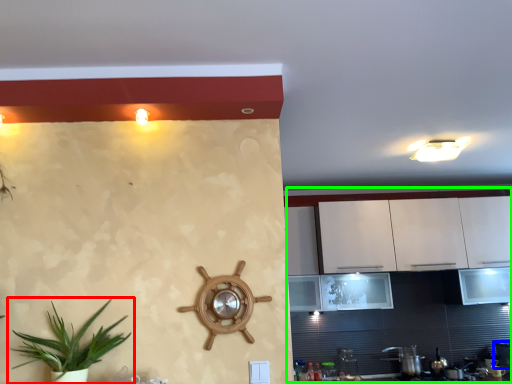
Question: Which object is the farthest from houseplant (highlighted by a red box)? Choose among these: appliance (highlighted by a blue box) or dresser (highlighted by a green box).

Choices:
 (A) appliance
 (B) dresser

Answer: (A)